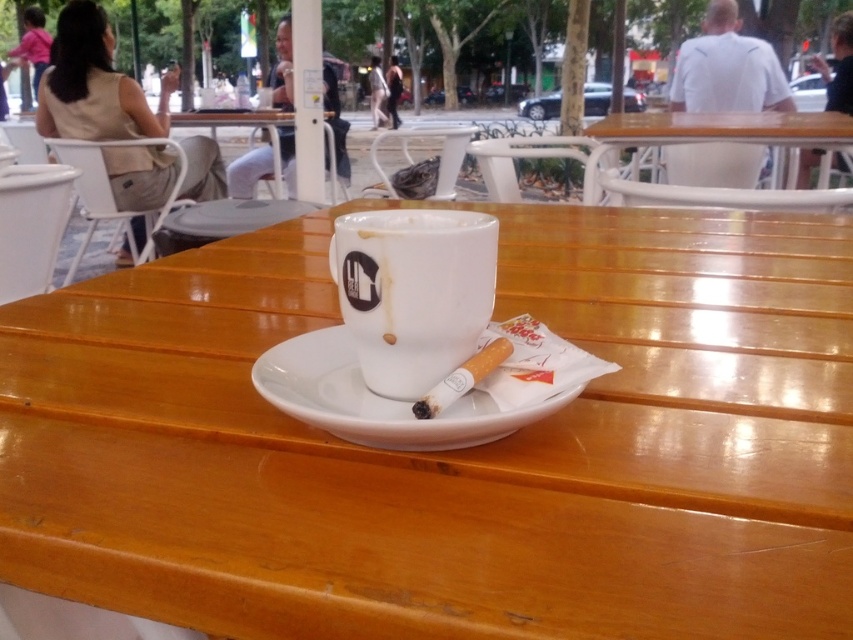
Question: Can you confirm if wooden table at center is positioned to the left of white ceramic saucer at center?

Choices:
 (A) yes
 (B) no

Answer: (B)

Question: Which of the following is the closest to the observer?

Choices:
 (A) white glossy mug at center
 (B) wooden table at upper right
 (C) wooden table at center
 (D) white ceramic saucer at center

Answer: (C)

Question: Which point is farther to the camera?

Choices:
 (A) white ceramic saucer at center
 (B) wooden table at upper right

Answer: (B)

Question: Does wooden table at center appear under wooden table at upper right?

Choices:
 (A) no
 (B) yes

Answer: (B)

Question: Which of the following is the closest to the observer?

Choices:
 (A) white ceramic saucer at center
 (B) wooden table at center
 (C) white glossy mug at center

Answer: (B)

Question: From the image, what is the correct spatial relationship of wooden table at center in relation to white glossy mug at center?

Choices:
 (A) left
 (B) right

Answer: (B)